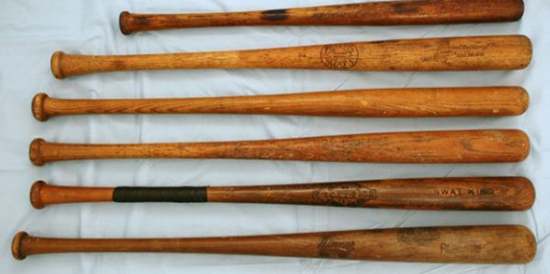
The height and width of the screenshot is (274, 550). In order to click on knob in this screenshot , I will do pyautogui.click(x=37, y=103), pyautogui.click(x=54, y=66), pyautogui.click(x=128, y=19), pyautogui.click(x=36, y=148), pyautogui.click(x=35, y=191), pyautogui.click(x=16, y=244).